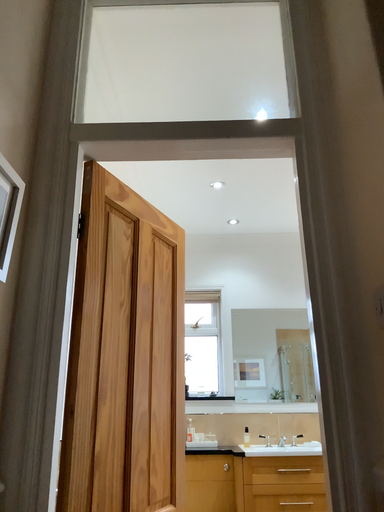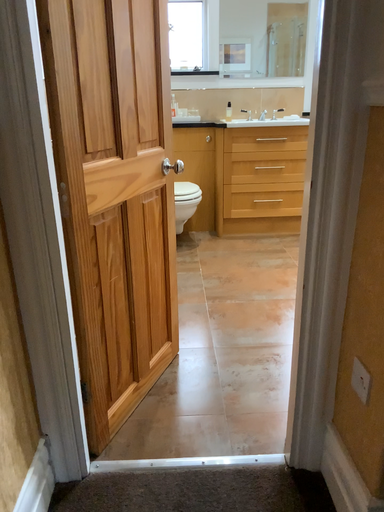
Question: Which way did the camera rotate in the video?

Choices:
 (A) rotated downward
 (B) rotated upward

Answer: (A)